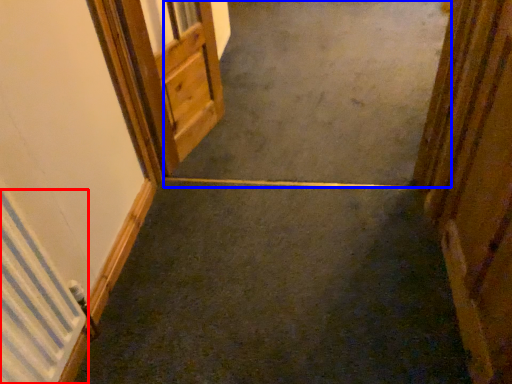
Question: Which object appears closest to the camera in this image, radiator (highlighted by a red box) or concrete (highlighted by a blue box)?

Choices:
 (A) radiator
 (B) concrete

Answer: (A)